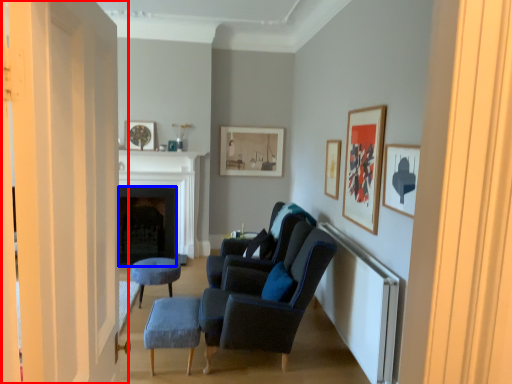
Question: Which point is further to the camera, door (highlighted by a red box) or fireplace (highlighted by a blue box)?

Choices:
 (A) door
 (B) fireplace

Answer: (B)